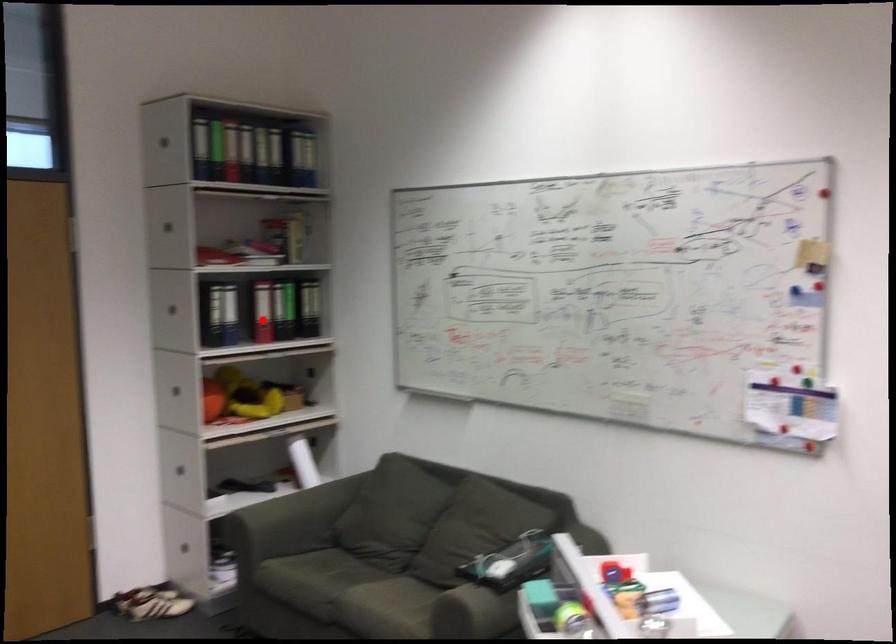
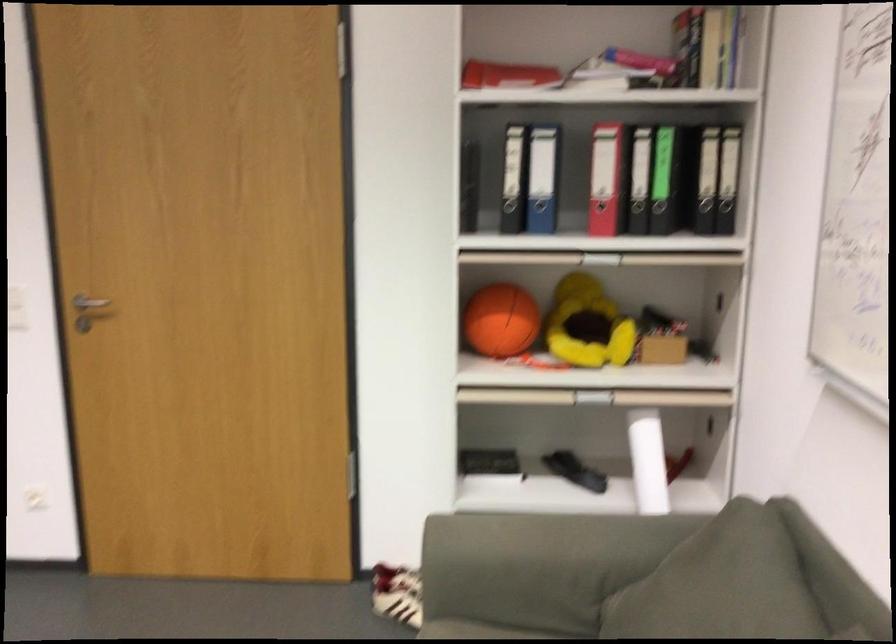
Question: I am providing you with two images of the same scene from different viewpoints. Image1 has a red point marked. In image2, the corresponding 3D location appears at what relative position? Reply with the corresponding letter.

Choices:
 (A) Closer
 (B) Farther

Answer: (A)